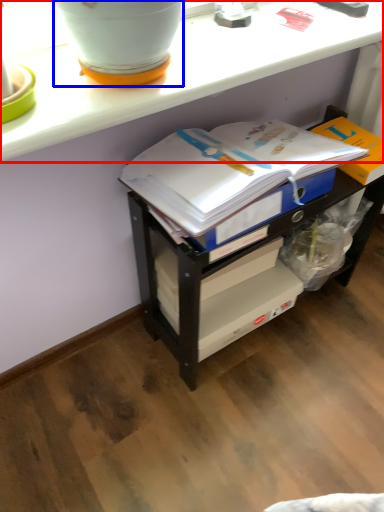
Question: Among these objects, which one is farthest to the camera, counter (highlighted by a red box) or flowerpot (highlighted by a blue box)?

Choices:
 (A) counter
 (B) flowerpot

Answer: (A)